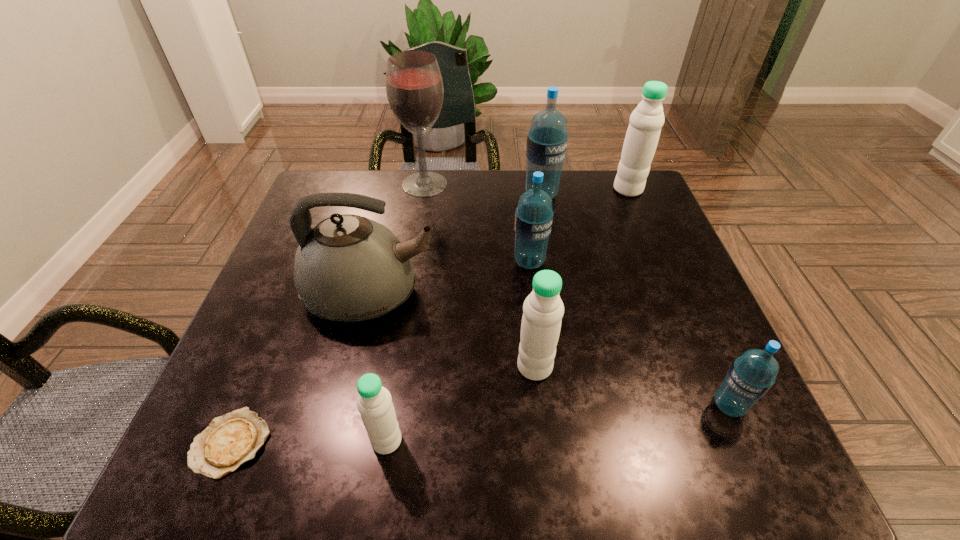
I want to click on free location located on the left of the third farthest water bottle, so click(457, 261).

Where is `free spot located 0.340m on the back of the nearest blue water bottle`? This screenshot has width=960, height=540. free spot located 0.340m on the back of the nearest blue water bottle is located at coordinates (666, 263).

I want to click on blank area located 0.340m on the back of the smallest white water bottle, so click(x=411, y=284).

I want to click on free spot located 0.050m on the back of the brown quiche, so click(x=255, y=384).

The height and width of the screenshot is (540, 960). In order to click on alcohol present at the far edge in this screenshot , I will do `click(414, 86)`.

What are the coordinates of `water bottle that is at the near edge` in the screenshot? It's located at (374, 403).

Find the location of a particular element. quiche that is at the near edge is located at coordinates (230, 440).

You are a GUI agent. You are given a task and a screenshot of the screen. Output one action in this format:
    pyautogui.click(x=<x>, y=<y>)
    Task: Click on the kettle that is at the left edge
    This screenshot has height=540, width=960.
    Given the screenshot: What is the action you would take?
    pyautogui.click(x=349, y=268)

Identify the location of quiche situated at the left edge. (230, 440).

Locate an element on the screen. object that is at the near left corner is located at coordinates (230, 440).